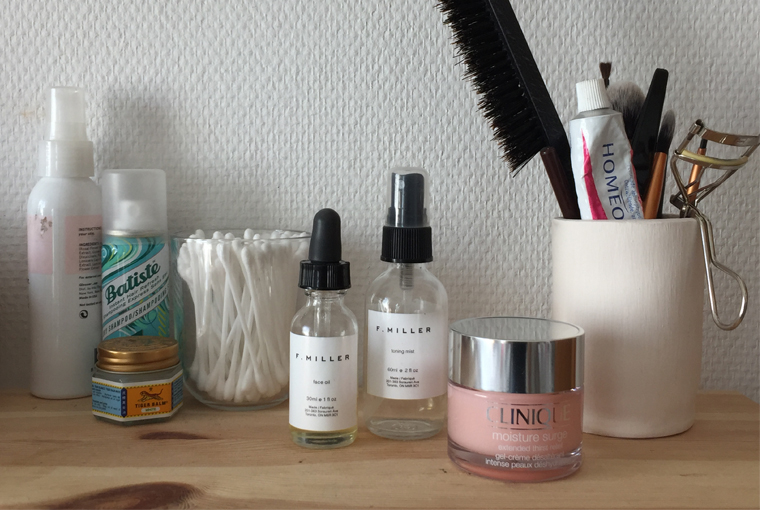
At what (x,y) coordinates should I click in order to perform the action: click on makeup brushes. Please return your answer as a coordinate pair (x, y). Looking at the image, I should click on (608, 72), (627, 96), (669, 136).